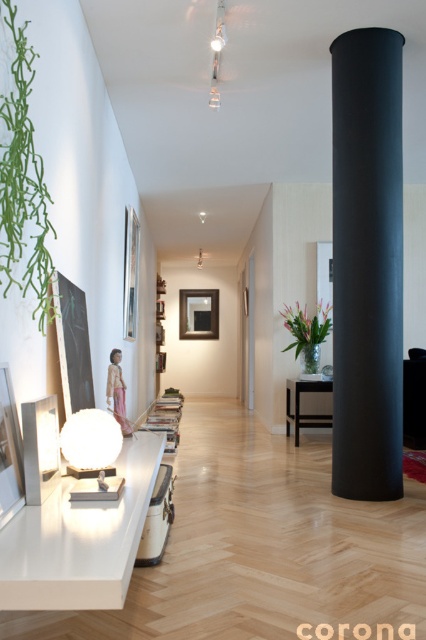
You are standing in the hallway and want to take a photo of both point (345, 289) and point (316, 336). Which point should you focus on first to ensure both are in focus?

You should focus on point (345, 289) first because it is closer to the camera than point (316, 336), so adjusting focus from near to far will help both points be in focus.